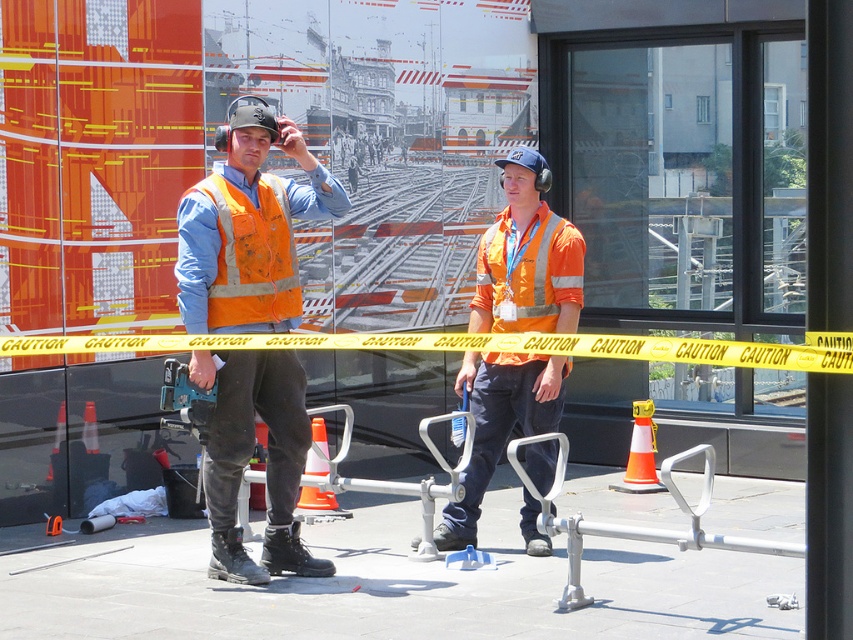
You are a safety inspector checking the visibility of safety vests at a construction site. You notice two safety vests in the scene. Which safety vest, the matte orange safety vest at center or the reflective orange safety vest at left, has a greater width?

The matte orange safety vest at center has a greater width than the reflective orange safety vest at left according to the description.

You are a construction supervisor trying to ensure safety protocols are followed. You need to check the distance between the two workers located at point [277,490] and point [218,225]. According to safety regulations, workers must maintain a minimum distance of 1.5 meters apart. Can you confirm if they are complying with the safety distance requirement?

Point [277,490] is behind point [218,225], so the distance between them is not specified in the description. Therefore, it is unclear if they are maintaining the required 1.5 meters distance. Further measurement is needed to confirm compliance.